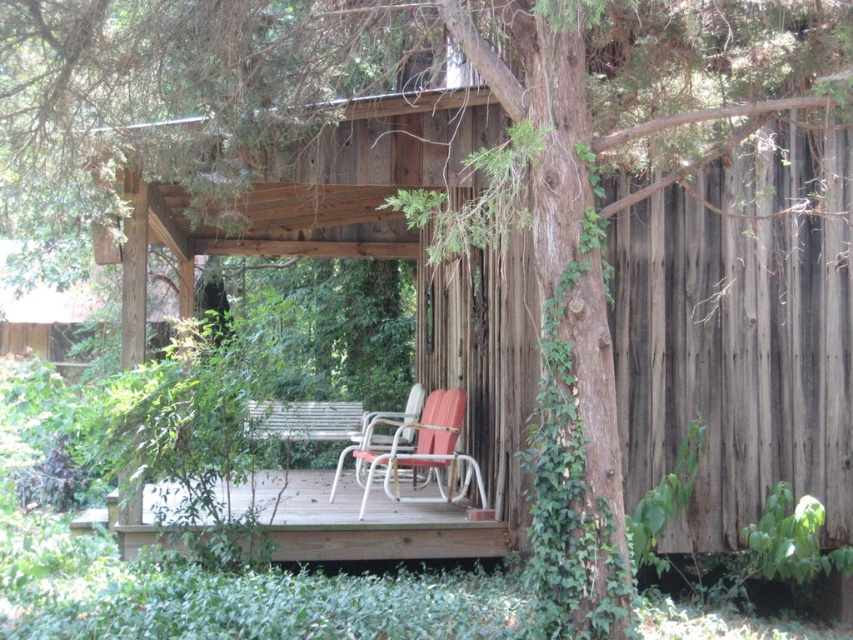
Question: Which object appears farthest from the camera in this image?

Choices:
 (A) metallic silver chair at center
 (B) metallic orange chair at center
 (C) wooden deck at center

Answer: (A)

Question: Can you confirm if wooden deck at center is positioned to the left of metallic silver chair at center?

Choices:
 (A) yes
 (B) no

Answer: (A)

Question: Can you confirm if metallic orange chair at center is positioned below metallic silver chair at center?

Choices:
 (A) yes
 (B) no

Answer: (A)

Question: Which point is closer to the camera taking this photo?

Choices:
 (A) (401, 452)
 (B) (308, 490)
 (C) (378, 448)

Answer: (B)

Question: Does wooden deck at center lie in front of metallic orange chair at center?

Choices:
 (A) yes
 (B) no

Answer: (A)

Question: Based on their relative distances, which object is farther from the metallic silver chair at center?

Choices:
 (A) metallic orange chair at center
 (B) wooden deck at center

Answer: (B)